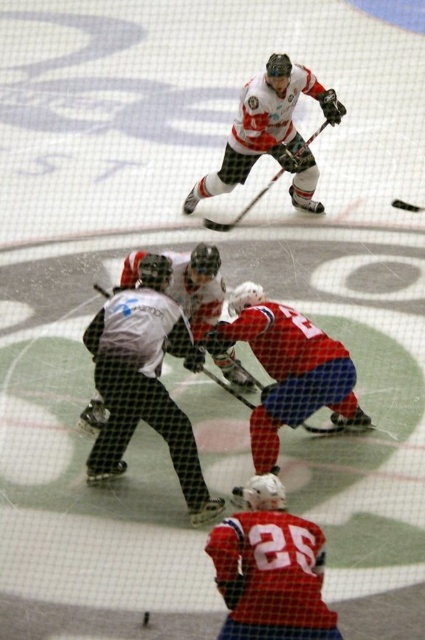
Question: Is white mesh referee at center thinner than matte black hockey stick at center?

Choices:
 (A) no
 (B) yes

Answer: (A)

Question: Is white mesh referee at center below matte black hockey stick at center?

Choices:
 (A) yes
 (B) no

Answer: (A)

Question: Among these objects, which one is nearest to the camera?

Choices:
 (A) matte black hockey stick at center
 (B) white mesh referee at center

Answer: (B)

Question: Among these objects, which one is farthest from the camera?

Choices:
 (A) white mesh referee at center
 (B) matte black hockey stick at center

Answer: (B)

Question: Can you confirm if white mesh referee at center is thinner than matte black hockey stick at center?

Choices:
 (A) yes
 (B) no

Answer: (B)

Question: Which of the following is the farthest from the observer?

Choices:
 (A) [255, 196]
 (B) [88, 340]

Answer: (A)